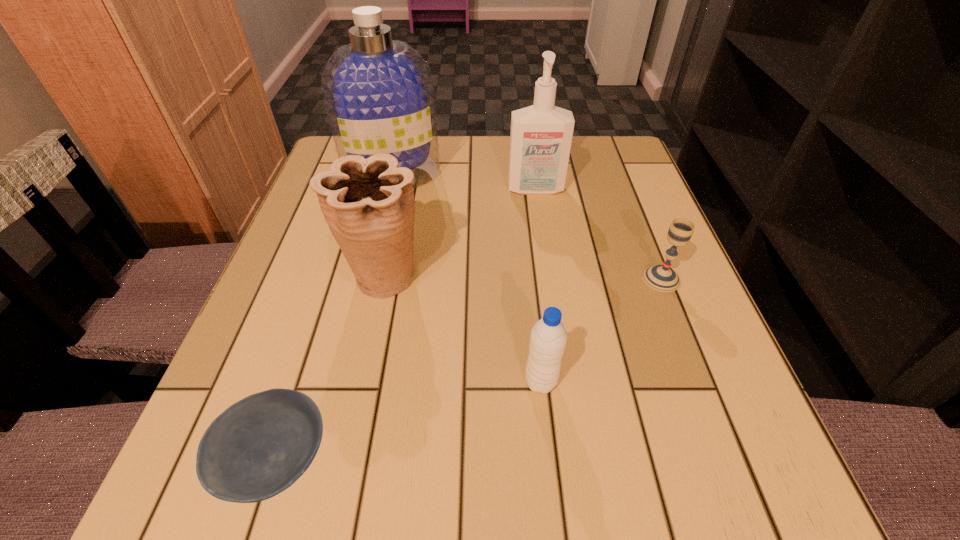
In order to click on free space that is in between the taller cleansing agent and the second shortest object in this screenshot , I will do `click(527, 226)`.

Find the location of a particular element. vacant space that's between the fourth shortest object and the second shortest object is located at coordinates (522, 277).

The height and width of the screenshot is (540, 960). What are the coordinates of `vacant area that lies between the fifth shortest object and the rightmost object` in the screenshot? It's located at (598, 234).

Identify the location of free spot between the left cleansing agent and the fourth tallest object. The height and width of the screenshot is (540, 960). (467, 278).

Where is `free space between the nearest object and the urn`? The height and width of the screenshot is (540, 960). free space between the nearest object and the urn is located at coordinates (330, 368).

Identify the location of blank region between the shortest object and the tallest object. (335, 317).

This screenshot has width=960, height=540. In order to click on free space between the taller cleansing agent and the shortest object in this screenshot , I will do `click(335, 317)`.

The width and height of the screenshot is (960, 540). Find the location of `vacant space that is in between the bowl and the fourth tallest object`. vacant space that is in between the bowl and the fourth tallest object is located at coordinates (409, 421).

The width and height of the screenshot is (960, 540). I want to click on the third closest object relative to the nearest object, so click(378, 92).

Select which object is the second closest to the nearest object. Please provide its 2D coordinates. Your answer should be formatted as a tuple, i.e. [(x, y)], where the tuple contains the x and y coordinates of a point satisfying the conditions above.

[(548, 338)]